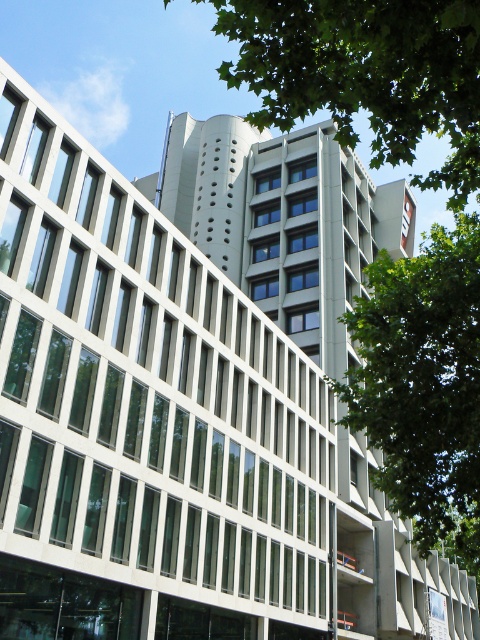
Question: In this image, where is green leafy tree at upper center located relative to green leafy tree at right?

Choices:
 (A) right
 (B) left

Answer: (B)

Question: Observing the image, what is the correct spatial positioning of green leafy tree at upper center in reference to green leafy tree at right?

Choices:
 (A) below
 (B) above

Answer: (B)

Question: Is green leafy tree at upper center bigger than green leafy tree at right?

Choices:
 (A) no
 (B) yes

Answer: (B)

Question: Which point is farther from the camera taking this photo?

Choices:
 (A) (478, 480)
 (B) (468, 81)

Answer: (A)